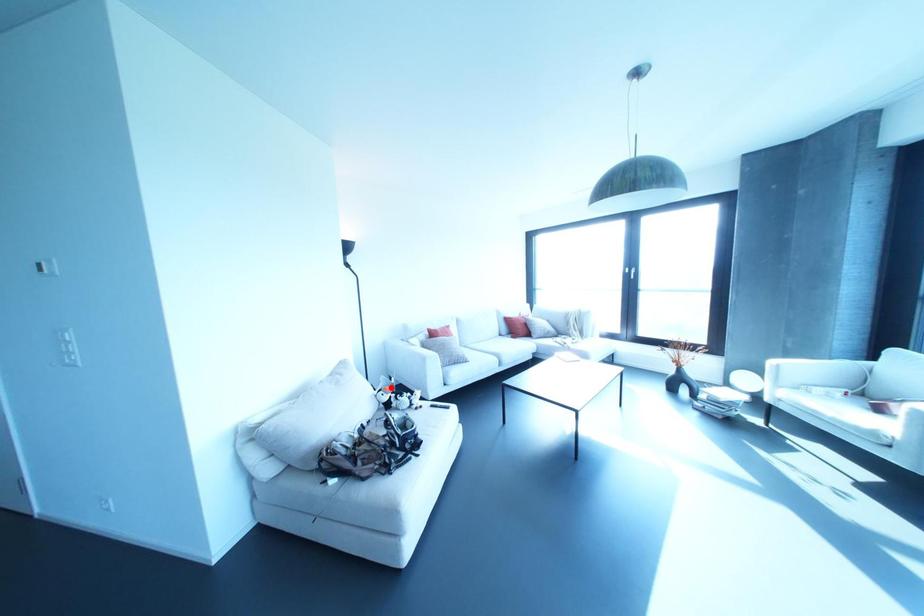
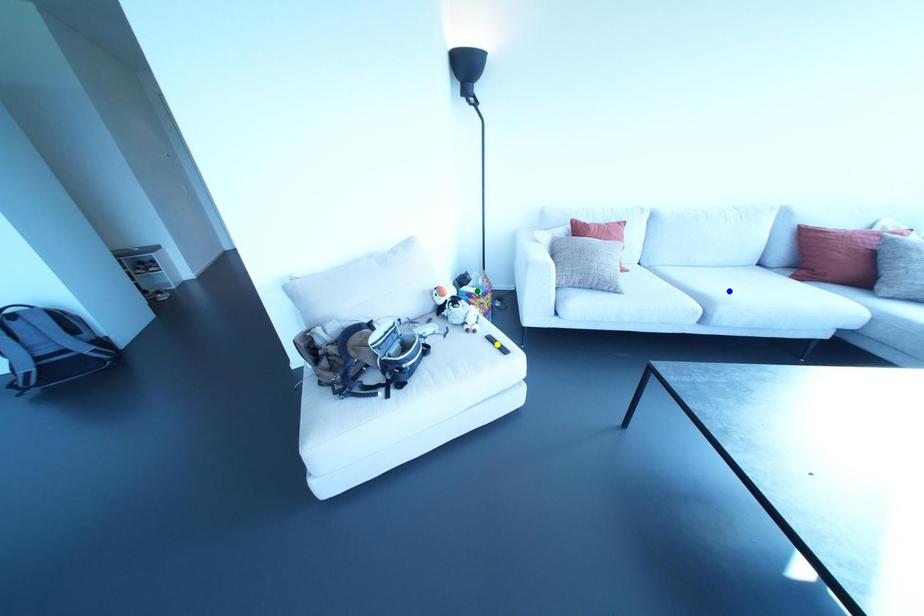
Question: I am providing you with two images of the same scene from different viewpoints. A red point is marked on the first image. You are given multiple points on the second image. Which point in image 2 represents the same 3d spot as the red point in image 1?

Choices:
 (A) blue point
 (B) yellow point
 (C) green point

Answer: (C)